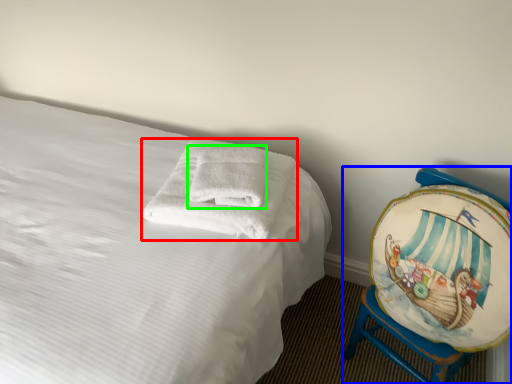
Question: Which object is positioned farthest from towel (highlighted by a red box)? Select from furniture (highlighted by a blue box) and bath towel (highlighted by a green box).

Choices:
 (A) furniture
 (B) bath towel

Answer: (A)